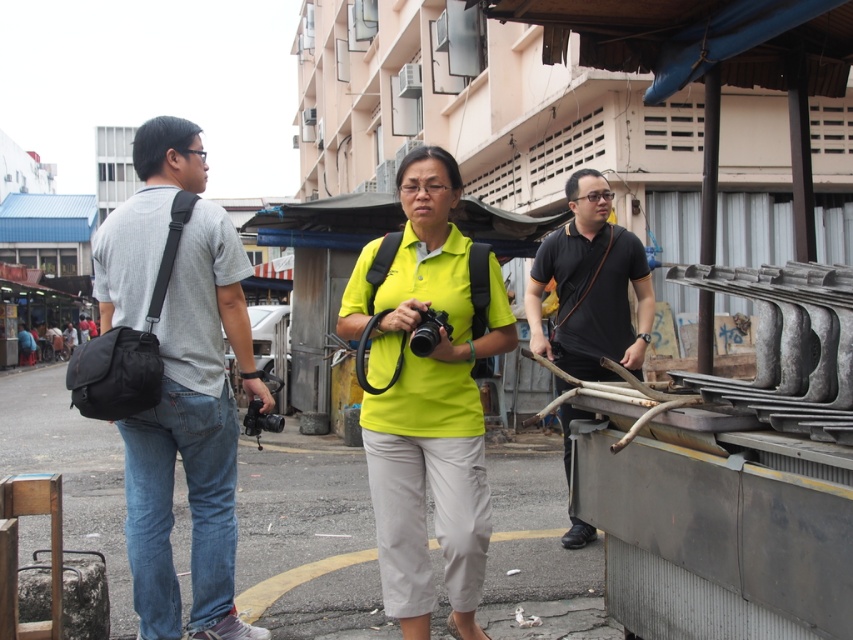
You are a photographer trying to take a picture of the black matte shirt at right. However, the black plastic camera at center is blocking your view. Can you move the camera to the side to get a clear shot?

The black plastic camera at center is behind the black matte shirt at right, so moving it might not be necessary as it is already positioned behind and not obstructing the view.